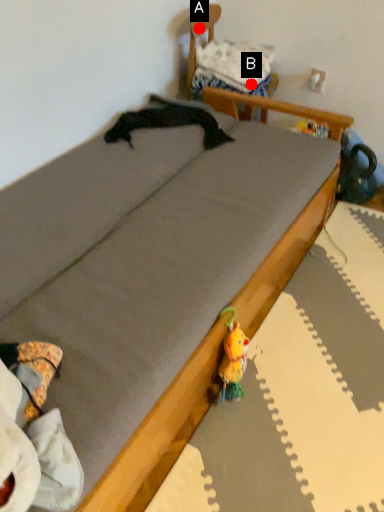
Question: Two points are circled on the image, labeled by A and B beside each circle. Which point is closer to the camera?

Choices:
 (A) A is closer
 (B) B is closer

Answer: (A)